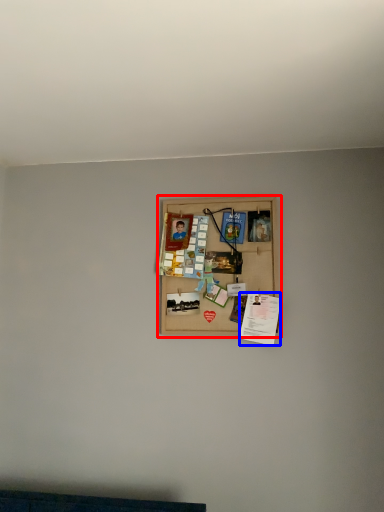
Question: Which point is further to the camera, picture frame (highlighted by a red box) or writing (highlighted by a blue box)?

Choices:
 (A) picture frame
 (B) writing

Answer: (A)